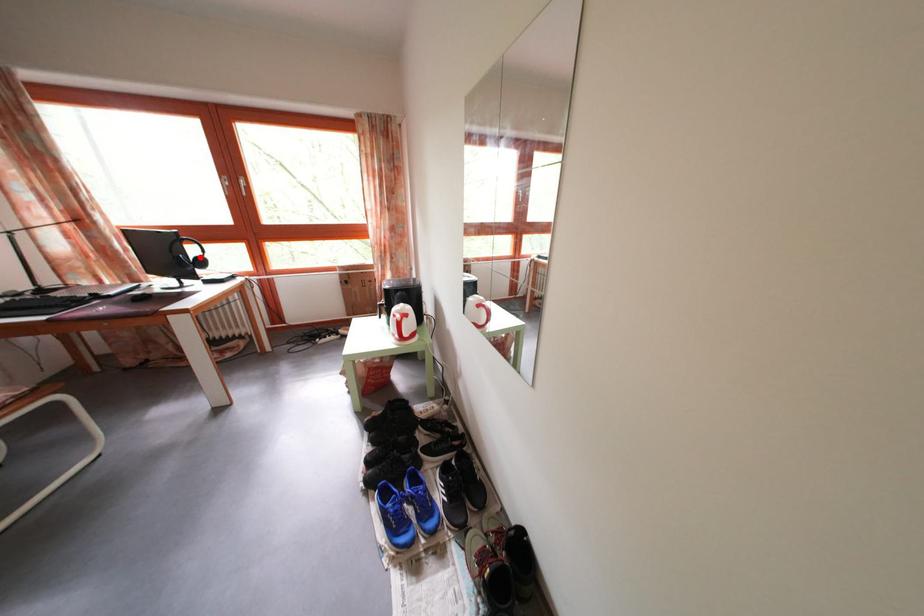
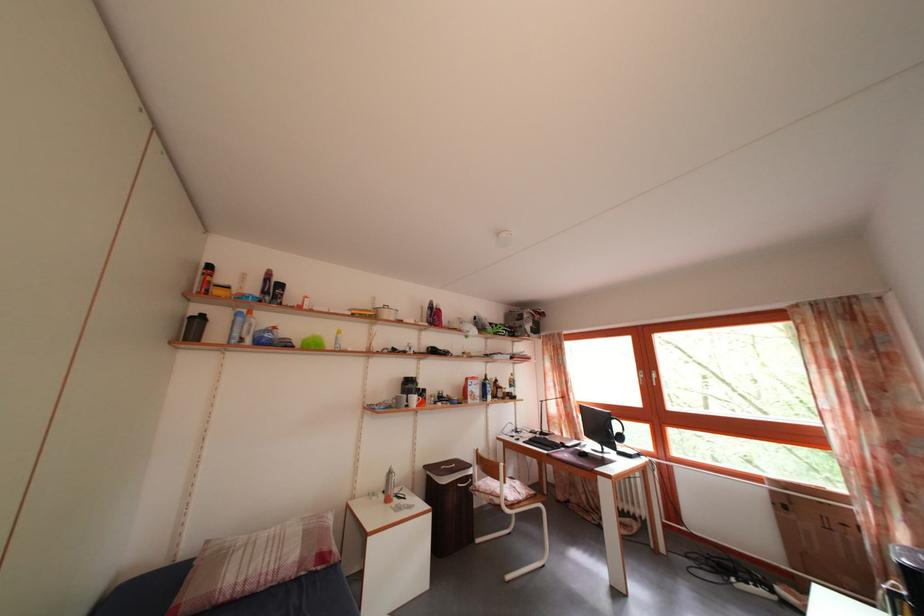
The point at the highlighted location is marked in the first image. Where is the corresponding point in the second image?

(624, 434)